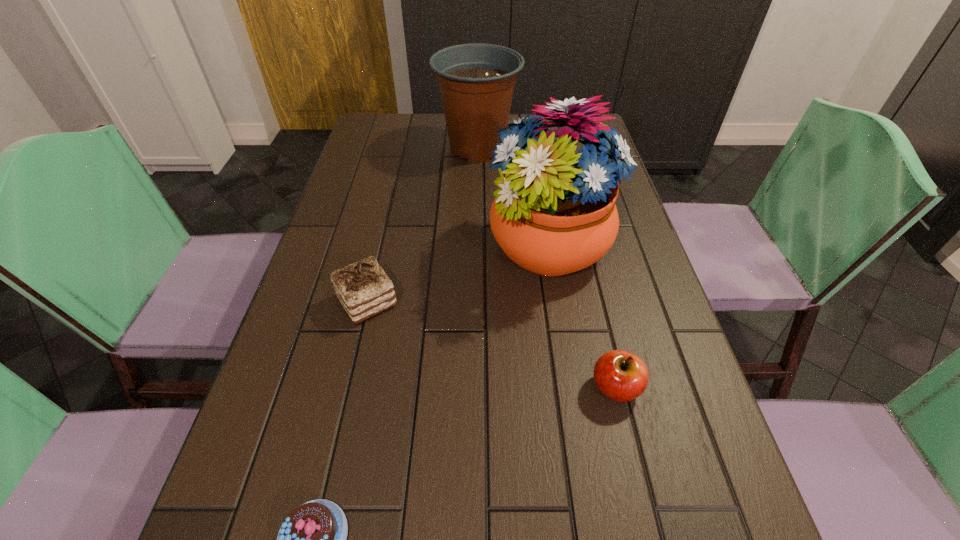
Locate an element on the screen. This screenshot has width=960, height=540. unoccupied position between the flowerpot and the farther chocolate cake is located at coordinates (422, 225).

Select which object appears as the fourth closest to the farther chocolate cake. Please provide its 2D coordinates. Your answer should be formatted as a tuple, i.e. [(x, y)], where the tuple contains the x and y coordinates of a point satisfying the conditions above.

[(476, 80)]

Locate which object ranks fourth in proximity to the fourth farthest object. Please provide its 2D coordinates. Your answer should be formatted as a tuple, i.e. [(x, y)], where the tuple contains the x and y coordinates of a point satisfying the conditions above.

[(476, 80)]

Where is `chocolate cake that stands as the second closest to the tallest object`? The width and height of the screenshot is (960, 540). chocolate cake that stands as the second closest to the tallest object is located at coordinates (312, 539).

The height and width of the screenshot is (540, 960). What are the coordinates of `vacant point that satisfies the following two spatial constraints: 1. on the back side of the tallest object; 2. on the left side of the taller chocolate cake` in the screenshot? It's located at (380, 248).